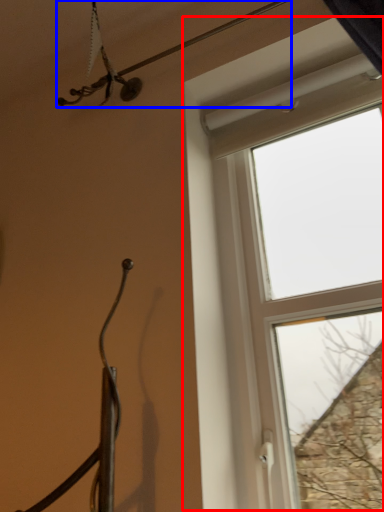
Question: Which object is further to the camera taking this photo, window (highlighted by a red box) or wire (highlighted by a blue box)?

Choices:
 (A) window
 (B) wire

Answer: (B)